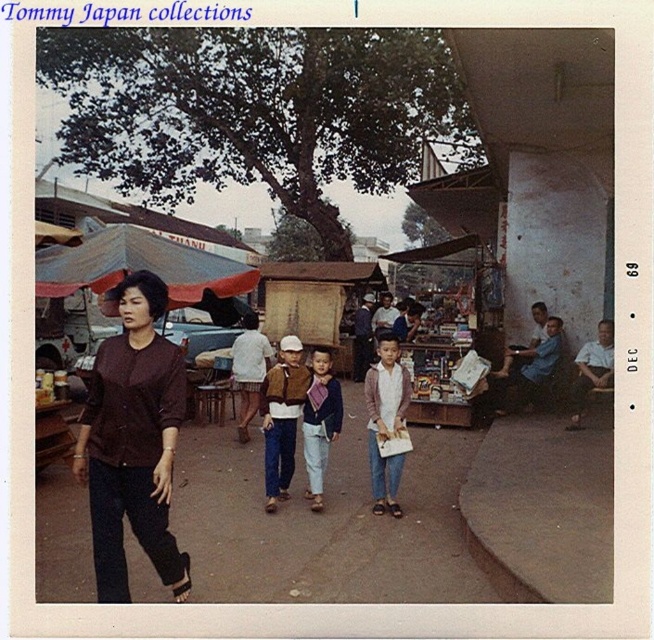
Question: Which point is closer to the camera taking this photo?

Choices:
 (A) coord(111,408)
 (B) coord(358,344)

Answer: (A)

Question: Which of the following is the closest to the observer?

Choices:
 (A) (145, 280)
 (B) (368, 326)

Answer: (A)

Question: Which point is closer to the camera?

Choices:
 (A) (182, 592)
 (B) (362, 360)

Answer: (A)

Question: Does brown fabric shirt at center appear on the left side of dark brown leather jacket at center?

Choices:
 (A) no
 (B) yes

Answer: (B)

Question: Does brown fabric shirt at center have a smaller size compared to dark brown leather jacket at center?

Choices:
 (A) yes
 (B) no

Answer: (B)

Question: Considering the relative positions of brown fabric shirt at center and dark brown leather jacket at center in the image provided, where is brown fabric shirt at center located with respect to dark brown leather jacket at center?

Choices:
 (A) below
 (B) above

Answer: (A)